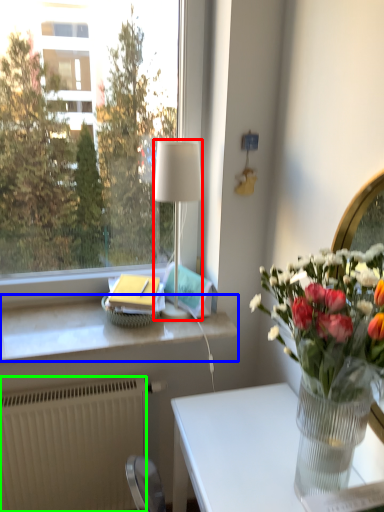
Question: Estimate the real-world distances between objects in this image. Which object is farther from lamp (highlighted by a red box), window sill (highlighted by a blue box) or radiator (highlighted by a green box)?

Choices:
 (A) window sill
 (B) radiator

Answer: (B)